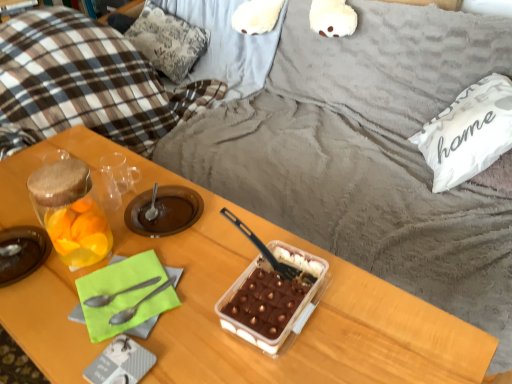
The image size is (512, 384). In order to click on vacant space behind translucent plastic tray at center, the 2th snack positioned from the left in this screenshot , I will do `click(254, 237)`.